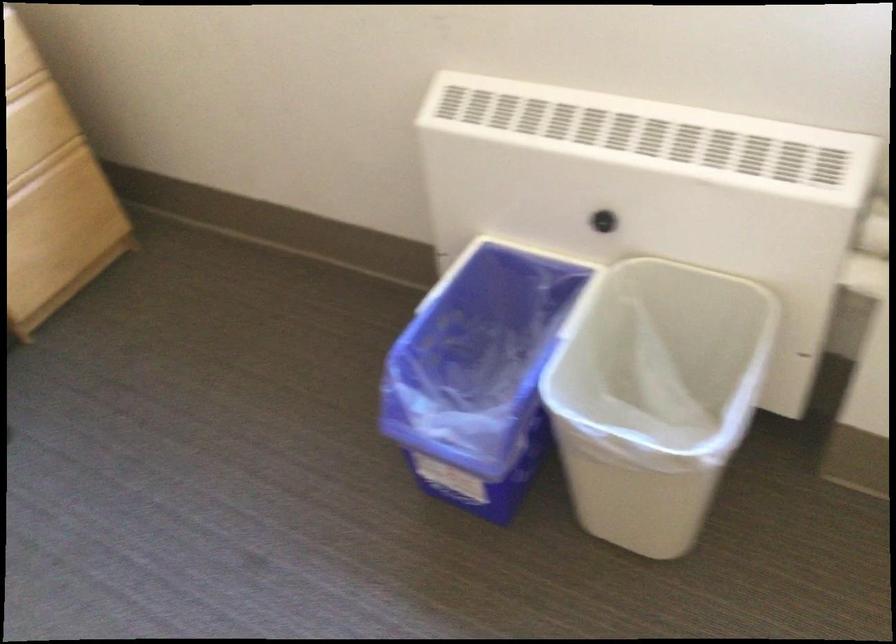
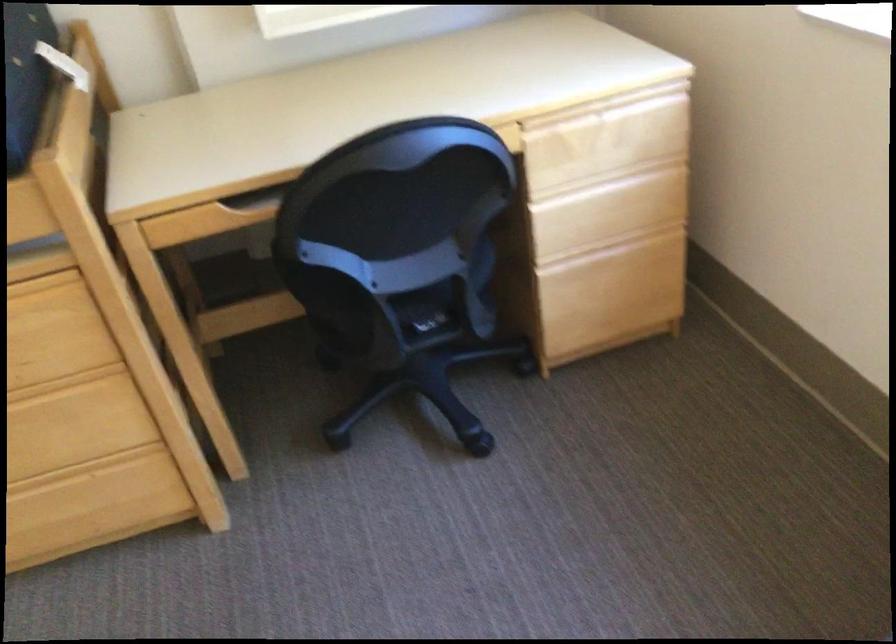
Question: The camera is either moving clockwise (left) or counter-clockwise (right) around the object. The first image is from the beginning of the video and the second image is from the end. Is the camera moving left or right when shooting the video?

Choices:
 (A) Left
 (B) Right

Answer: (B)